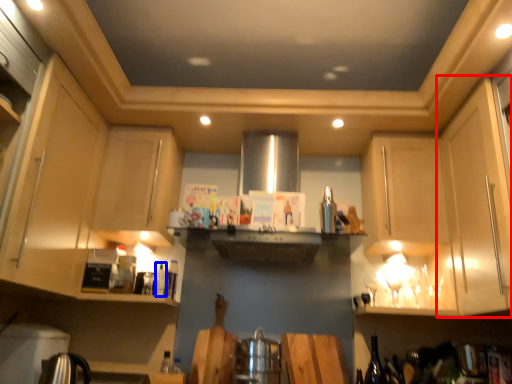
Question: Among these objects, which one is nearest to the camera, cabinetry (highlighted by a red box) or bottle (highlighted by a blue box)?

Choices:
 (A) cabinetry
 (B) bottle

Answer: (A)